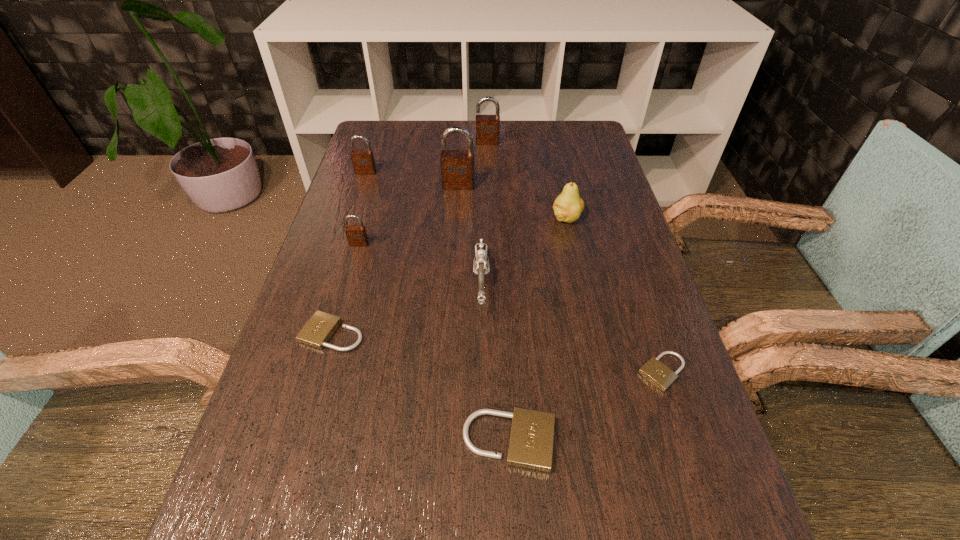
I want to click on unoccupied position between the second shortest object and the second farthest padlock, so click(x=349, y=253).

At what (x,y) coordinates should I click in order to perform the action: click on object that is the third closest to the gun. Please return your answer as a coordinate pair (x, y). Looking at the image, I should click on (319, 329).

Identify which object is the seventh nearest to the gun. Please provide its 2D coordinates. Your answer should be formatted as a tuple, i.e. [(x, y)], where the tuple contains the x and y coordinates of a point satisfying the conditions above.

[(363, 161)]

The width and height of the screenshot is (960, 540). I want to click on padlock that is the fourth closest to the second smallest brown padlock, so click(x=319, y=329).

At what (x,y) coordinates should I click in order to perform the action: click on the third closest padlock to the second shortest padlock. Please return your answer as a coordinate pair (x, y). Looking at the image, I should click on (457, 166).

Find the location of a particular element. This screenshot has width=960, height=540. brown padlock that stands as the closest to the rightmost brown padlock is located at coordinates (457, 166).

Select which brown padlock is the third closest to the gun. Please provide its 2D coordinates. Your answer should be formatted as a tuple, i.e. [(x, y)], where the tuple contains the x and y coordinates of a point satisfying the conditions above.

[(363, 161)]

The image size is (960, 540). Identify the location of beige padlock that is the second closest to the gun. (319, 329).

The width and height of the screenshot is (960, 540). Find the location of `beige padlock identified as the third closest to the sixth nearest object`. beige padlock identified as the third closest to the sixth nearest object is located at coordinates (531, 440).

You are a GUI agent. You are given a task and a screenshot of the screen. Output one action in this format:
    pyautogui.click(x=<x>, y=<y>)
    Task: Click on the free space that satisfies the following two spatial constraints: 1. on the front side of the pear; 2. on the right side of the shortest object
    The image size is (960, 540).
    Given the screenshot: What is the action you would take?
    pyautogui.click(x=599, y=372)